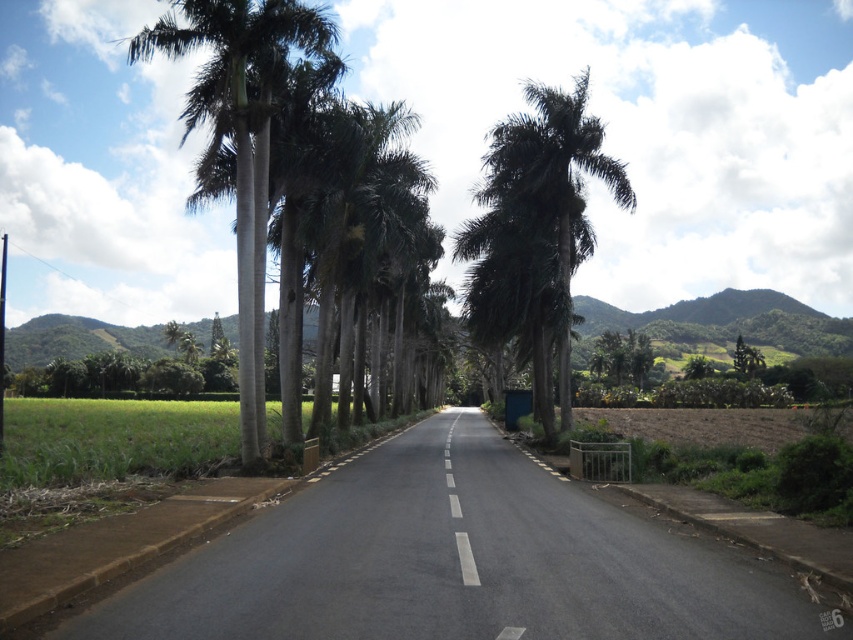
Who is positioned more to the left, white smooth palm trees at left or white smooth line at center?

white smooth palm trees at left is more to the left.

Measure the distance from white smooth palm trees at left to white smooth line at center.

A distance of 18.31 meters exists between white smooth palm trees at left and white smooth line at center.

Describe the element at coordinates (241, 138) in the screenshot. I see `white smooth palm trees at left` at that location.

Identify the location of white smooth palm trees at left. This screenshot has width=853, height=640. (x=241, y=138).

The height and width of the screenshot is (640, 853). Identify the location of green leafy palm tree at center. (537, 234).

Based on the photo, does green leafy palm tree at center have a smaller size compared to white smooth line at center?

Incorrect, green leafy palm tree at center is not smaller in size than white smooth line at center.

I want to click on green leafy palm tree at center, so click(x=537, y=234).

Identify the location of green leafy palm tree at center. (537, 234).

Is point (486, 266) less distant than point (231, 104)?

No, (486, 266) is further to viewer.

Between green leafy palm tree at center and white smooth palm trees at left, which one is positioned higher?

green leafy palm tree at center

Who is more forward, (555, 188) or (276, 44)?

→ Point (276, 44) is in front.

The image size is (853, 640). Identify the location of green leafy palm tree at center. (537, 234).